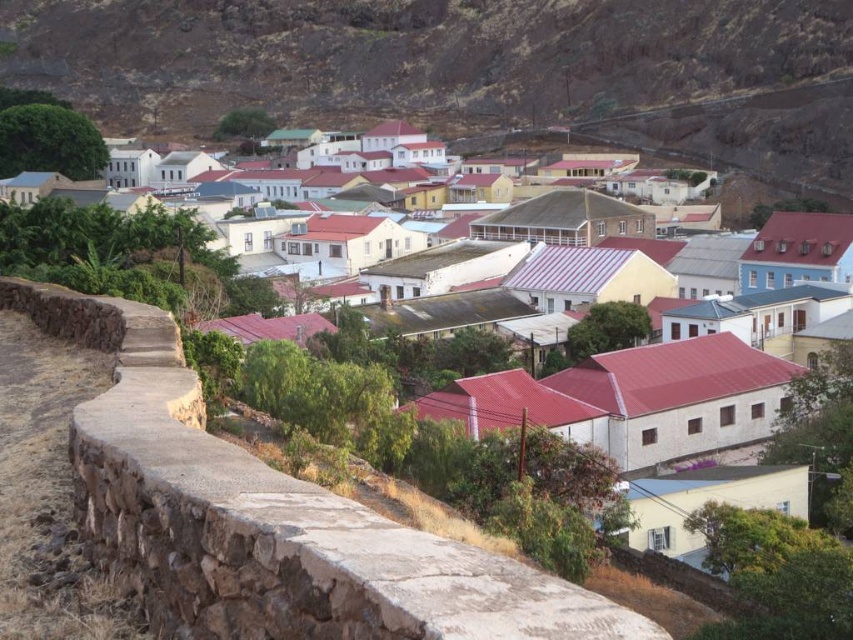
Question: Does white stone houses at center have a smaller size compared to brown stone wall at lower left?

Choices:
 (A) yes
 (B) no

Answer: (B)

Question: Does white stone houses at center appear on the right side of brown stone wall at lower left?

Choices:
 (A) no
 (B) yes

Answer: (A)

Question: Which point is closer to the camera?

Choices:
 (A) (242, 467)
 (B) (798, 77)

Answer: (A)

Question: Estimate the real-world distances between objects in this image. Which object is farther from the brown stone wall at lower left?

Choices:
 (A) brown stone ledge at lower left
 (B) white stone houses at center

Answer: (B)

Question: Can you confirm if white stone houses at center is positioned above brown stone ledge at lower left?

Choices:
 (A) yes
 (B) no

Answer: (A)

Question: Which point is closer to the camera taking this photo?

Choices:
 (A) (233, 540)
 (B) (178, 464)
 (C) (838, 52)

Answer: (A)